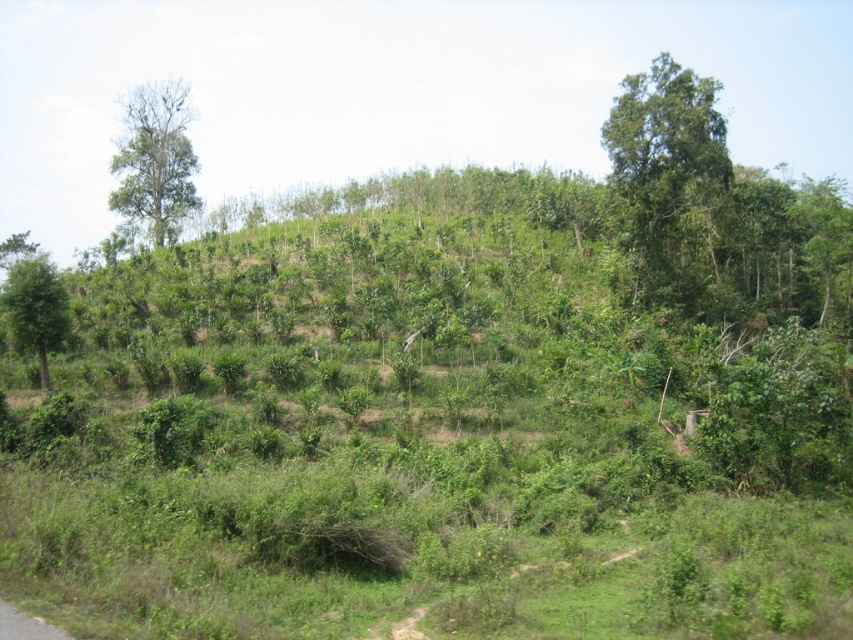
Describe the element at coordinates (155, 160) in the screenshot. This screenshot has width=853, height=640. I see `bare wood tree at upper left` at that location.

Can you confirm if bare wood tree at upper left is positioned to the right of green leafy tree at left?

No, bare wood tree at upper left is not to the right of green leafy tree at left.

What do you see at coordinates (155, 160) in the screenshot? The width and height of the screenshot is (853, 640). I see `bare wood tree at upper left` at bounding box center [155, 160].

In order to click on bare wood tree at upper left in this screenshot , I will do `click(155, 160)`.

How distant is green leafy tree at upper right from bare wood tree at upper left?

They are 133.32 feet apart.

At what (x,y) coordinates should I click in order to perform the action: click on green leafy tree at upper right. Please return your answer as a coordinate pair (x, y). Looking at the image, I should click on (668, 179).

Identify the location of green leafy tree at upper right. The height and width of the screenshot is (640, 853). (668, 179).

Is green leafy tree at upper right smaller than green leafy tree at left?

Actually, green leafy tree at upper right might be larger than green leafy tree at left.

The width and height of the screenshot is (853, 640). What do you see at coordinates (668, 179) in the screenshot?
I see `green leafy tree at upper right` at bounding box center [668, 179].

I want to click on green leafy tree at upper right, so click(x=668, y=179).

This screenshot has height=640, width=853. In order to click on green leafy tree at upper right in this screenshot , I will do `click(668, 179)`.